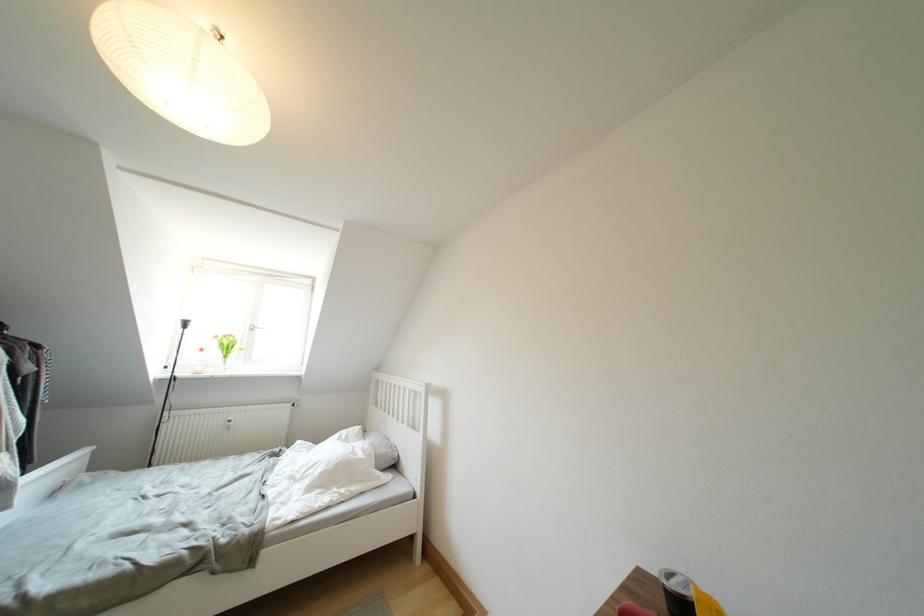
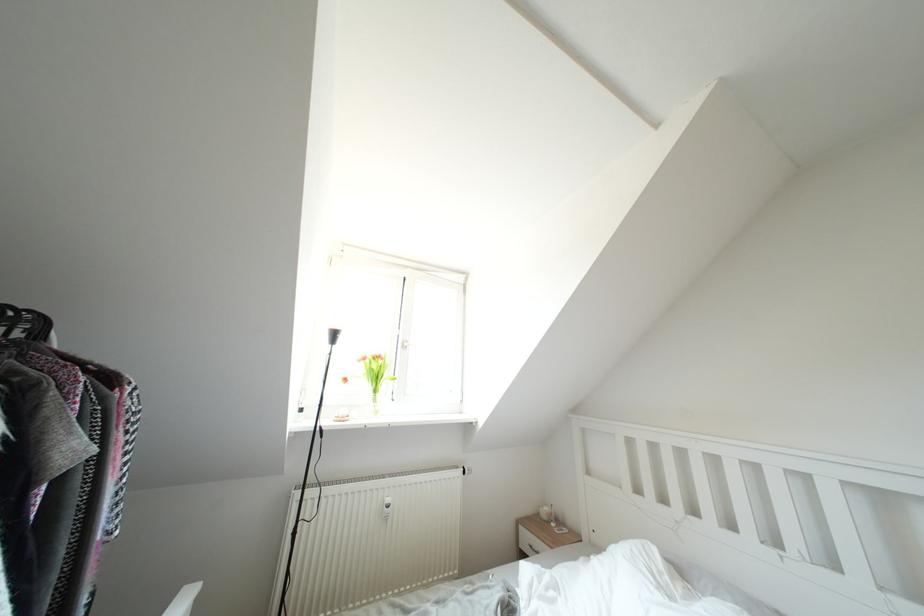
In the scene shown: Which direction would the cameraman need to move to produce the second image?

The cameraman walked toward left, forward.